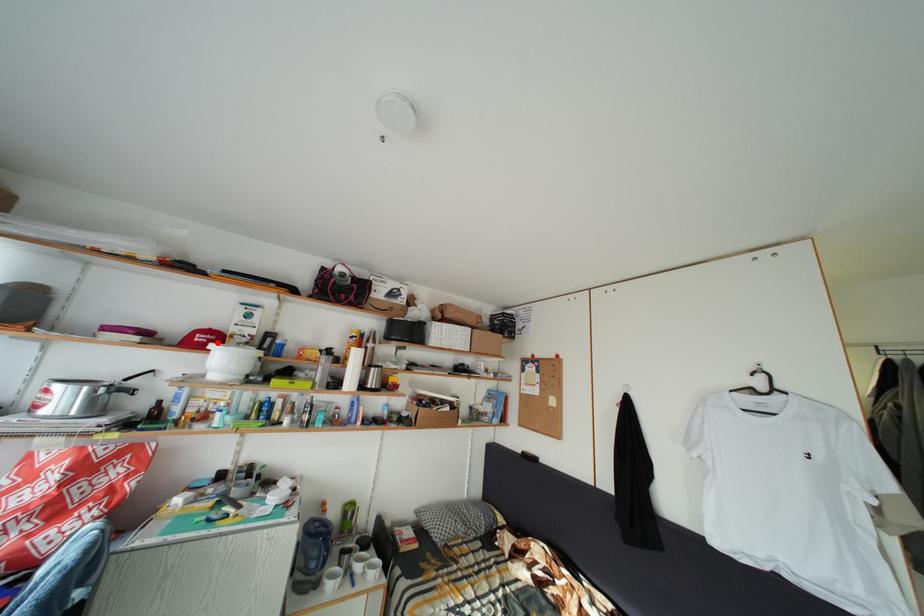
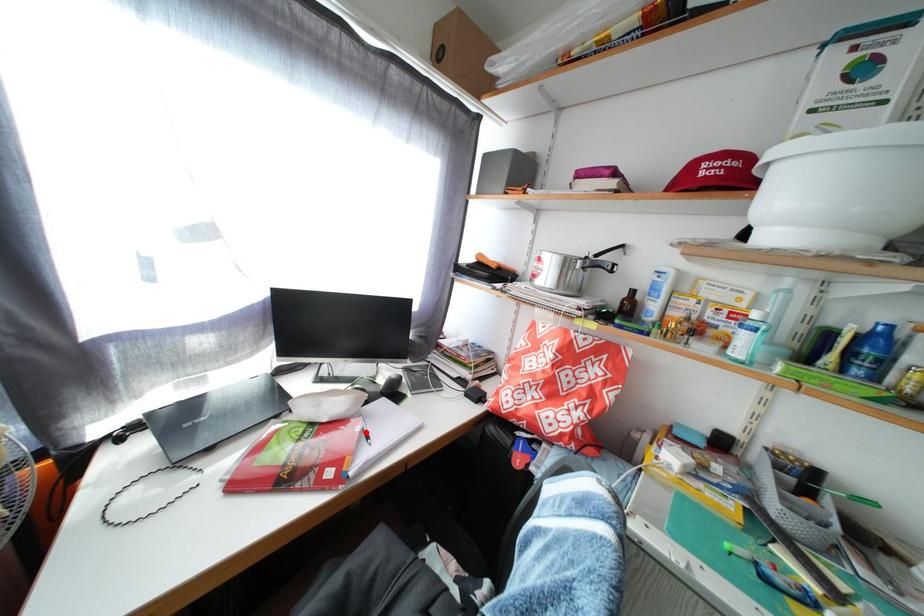
I am providing you with two images of the same scene from different viewpoints. A red point is marked on the first image and another point is marked on the second image. Is the marked point in image1 the same physical position as the marked point in image2?

No